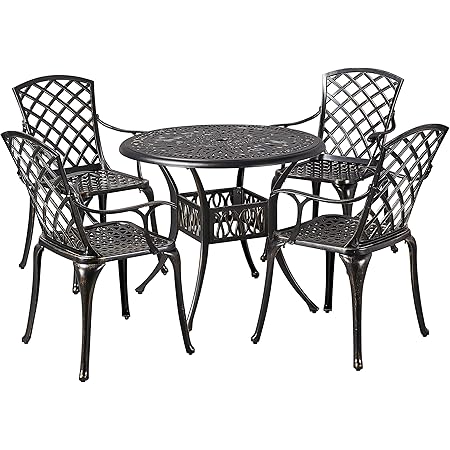
Where is `front chair legs`? front chair legs is located at coordinates (180, 293), (123, 293), (78, 277), (149, 193), (266, 256), (349, 211), (264, 328), (333, 285).